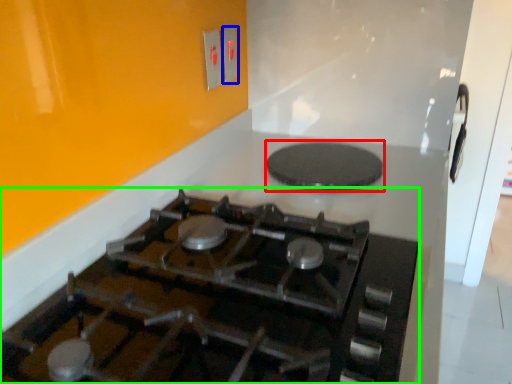
Question: Which object is the closest to the pizza pan (highlighted by a red box)? Choose among these: electric outlet (highlighted by a blue box) or gas stove (highlighted by a green box).

Choices:
 (A) electric outlet
 (B) gas stove

Answer: (B)